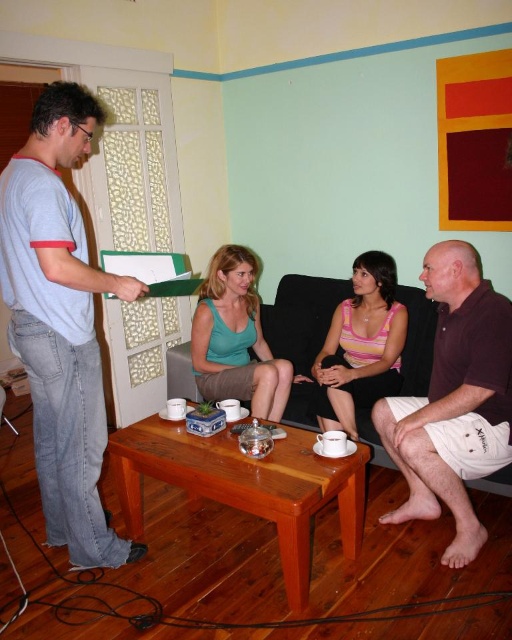
Question: Is dark brown leather couch at center above green matte tank top at center?

Choices:
 (A) yes
 (B) no

Answer: (B)

Question: Can you confirm if dark brown leather couch at center is positioned below pink striped dress at center?

Choices:
 (A) no
 (B) yes

Answer: (B)

Question: Based on their relative distances, which object is nearer to the light blue t-shirt at left?

Choices:
 (A) dark brown leather couch at center
 (B) brown cotton shorts at lower right
 (C) green matte tank top at center
 (D) pink striped dress at center

Answer: (C)

Question: Which of the following is the closest to the observer?

Choices:
 (A) (276, 369)
 (B) (292, 353)

Answer: (A)

Question: Is the position of brown cotton shorts at lower right less distant than that of green matte tank top at center?

Choices:
 (A) yes
 (B) no

Answer: (A)

Question: Estimate the real-world distances between objects in this image. Which object is closer to the light blue t-shirt at left?

Choices:
 (A) pink striped dress at center
 (B) dark brown leather couch at center

Answer: (A)